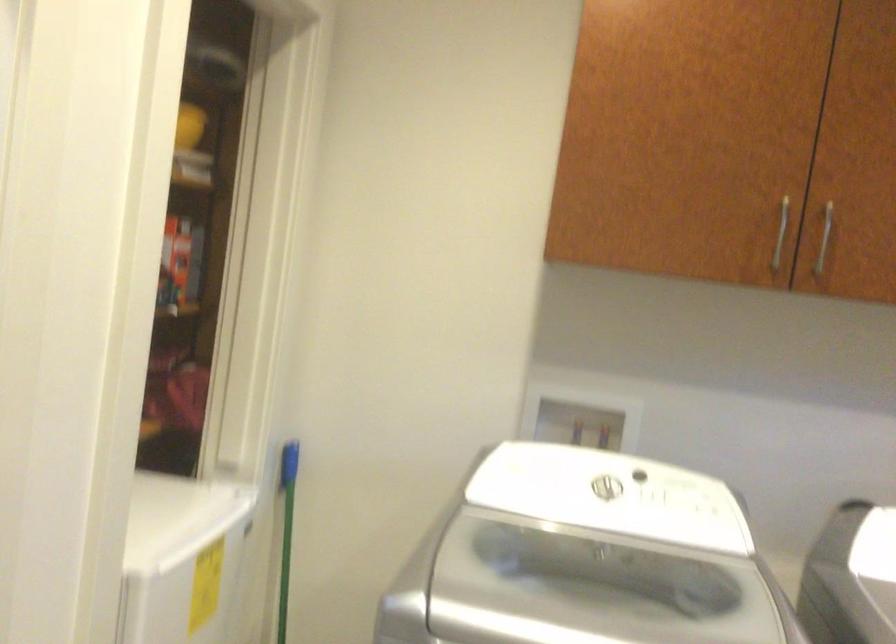
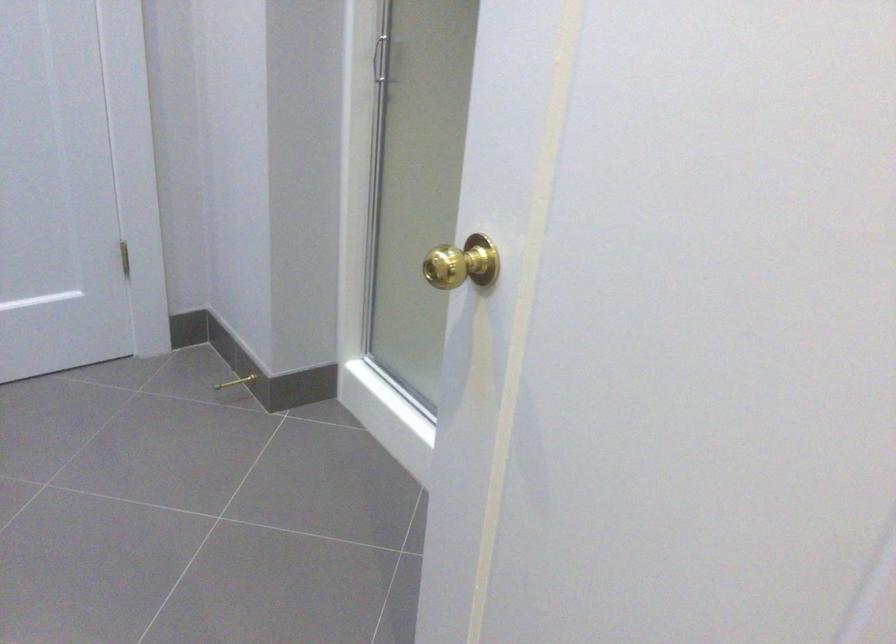
First-person continuous shooting, in which direction is the camera rotating?

The camera's rotation is toward left-down.